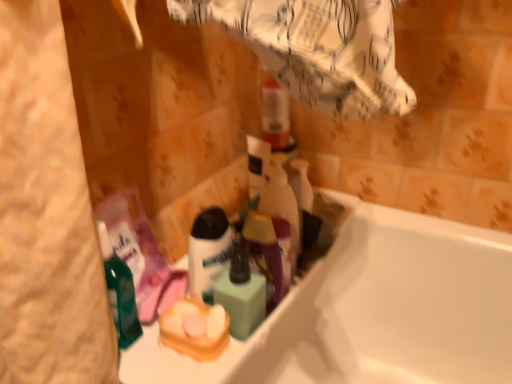
Question: From the image's perspective, is yellow sponge at center above or below translucent purple spray bottle at center?

Choices:
 (A) below
 (B) above

Answer: (A)

Question: Does point (210, 352) appear closer or farther from the camera than point (266, 205)?

Choices:
 (A) closer
 (B) farther

Answer: (A)

Question: Considering the real-world distances, which object is closest to the green matte mouthwash at center?

Choices:
 (A) white glossy bathtub at lower right
 (B) yellow sponge at center
 (C) translucent purple spray bottle at center
 (D) white matte shaving cream at center

Answer: (D)

Question: Which object is the farthest from the green matte mouthwash at center?

Choices:
 (A) yellow sponge at center
 (B) white matte shaving cream at center
 (C) white glossy bathtub at lower right
 (D) translucent purple spray bottle at center

Answer: (C)